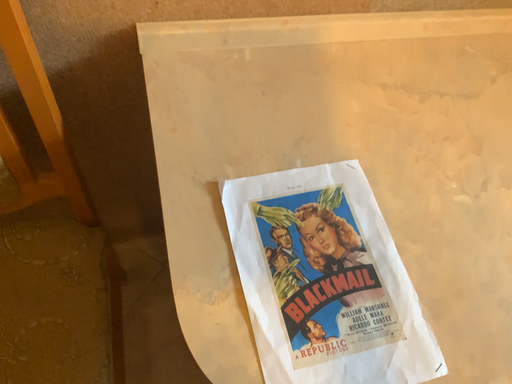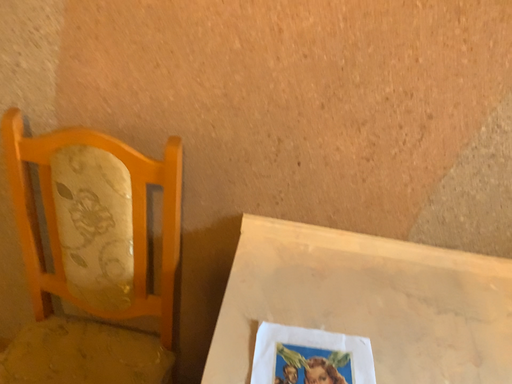
Question: Which way did the camera rotate in the video?

Choices:
 (A) rotated left
 (B) rotated right

Answer: (A)